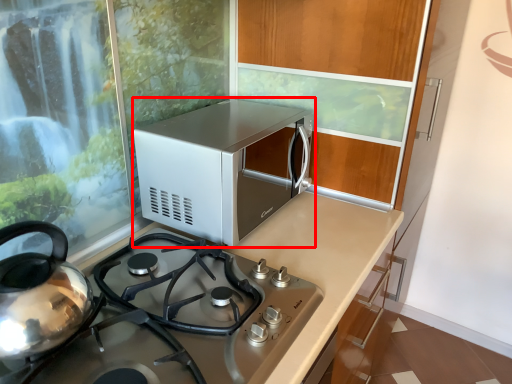
Question: In this image, where is microwave oven (annotated by the red box) located relative to countertop?

Choices:
 (A) left
 (B) right

Answer: (B)